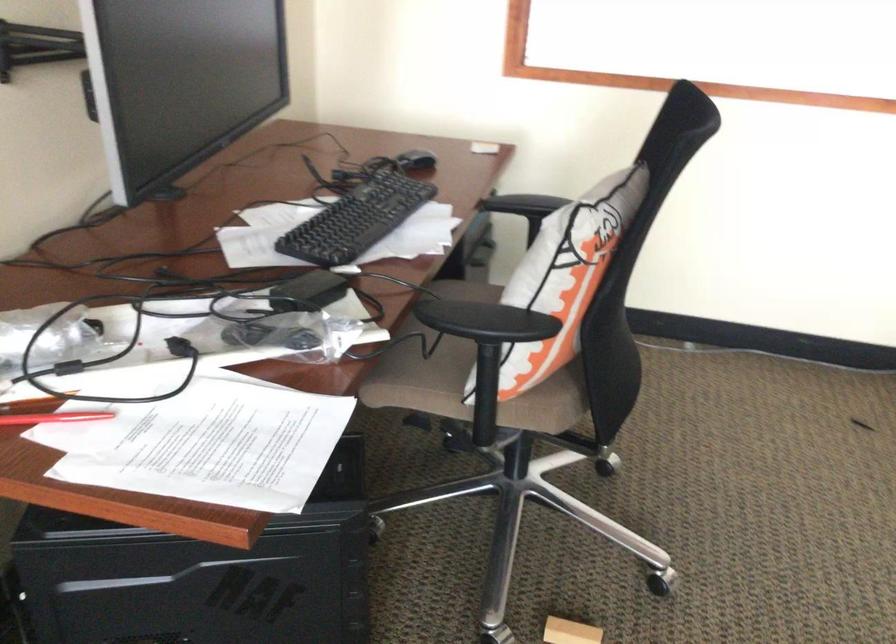
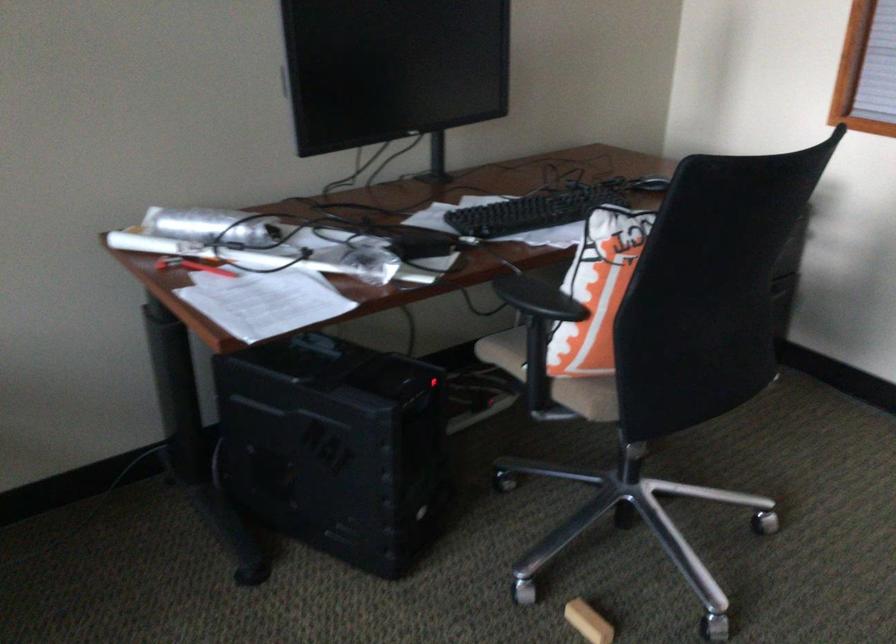
In the second image, find the point that corresponds to point (433, 166) in the first image.

(648, 185)